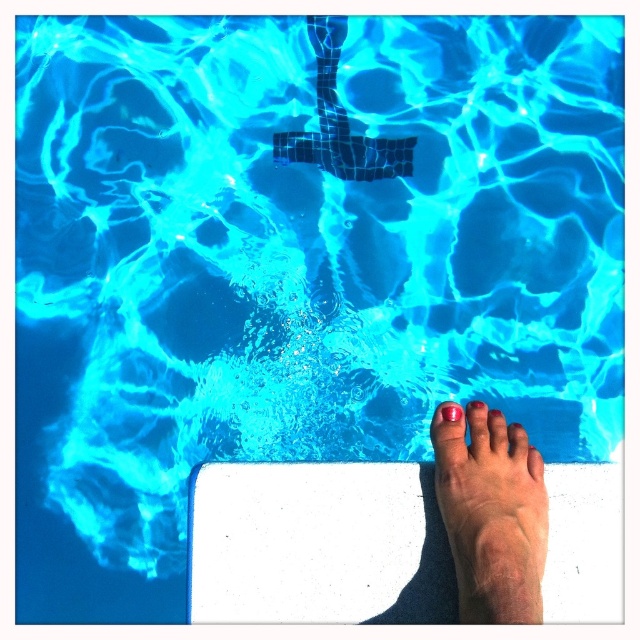
You are standing at the edge of the pool and want to place a small floating toy exactly at the point marked as point (465,596). If you can throw the toy 1.2 meters, will you be able to reach that point from your current position?

The point (465,596) is 1.28 meters away from you, which is slightly farther than the 1.2 meters you can throw. Therefore, you won

You are a photographer capturing the scene of a foot entering a pool. You need to ensure that both the smooth skin foot at lower right and the pink matte nail at center are visible in the frame. Based on their positions, which object should you focus on first to ensure both are in the shot?

The smooth skin foot at lower right is positioned on the left side of the pink matte nail at center. To ensure both are in the shot, focus on the pink matte nail at center first as it is centrally located and the foot is to its left, making it easier to frame both together.

You are a lifeguard standing at the edge of the pool. You notice a foot in the water. Where is the smooth skin foot at lower right located in the pool?

The smooth skin foot at lower right is located at point (490, 515) in the pool.